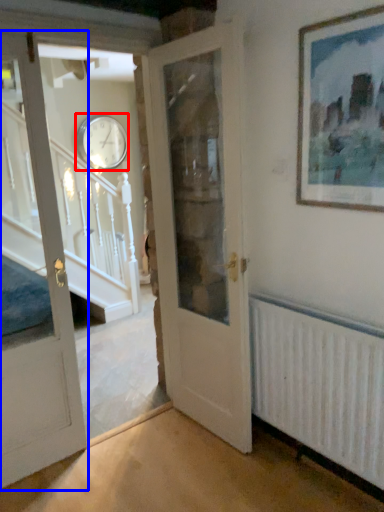
Question: Among these objects, which one is nearest to the camera, clock (highlighted by a red box) or door (highlighted by a blue box)?

Choices:
 (A) clock
 (B) door

Answer: (B)